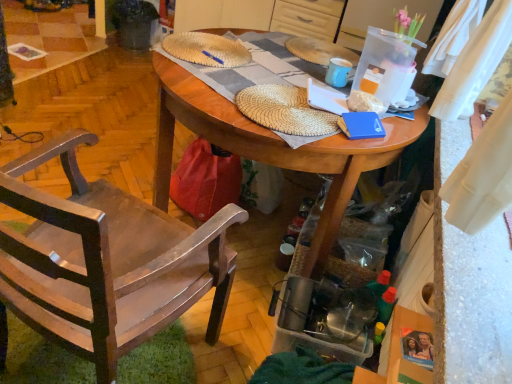
I want to click on vacant area that lies between woven straw hat at upper center, marked as the second hat in a front-to-back arrangement, and woven straw hat at center, the first hat when ordered from front to back, so click(x=236, y=70).